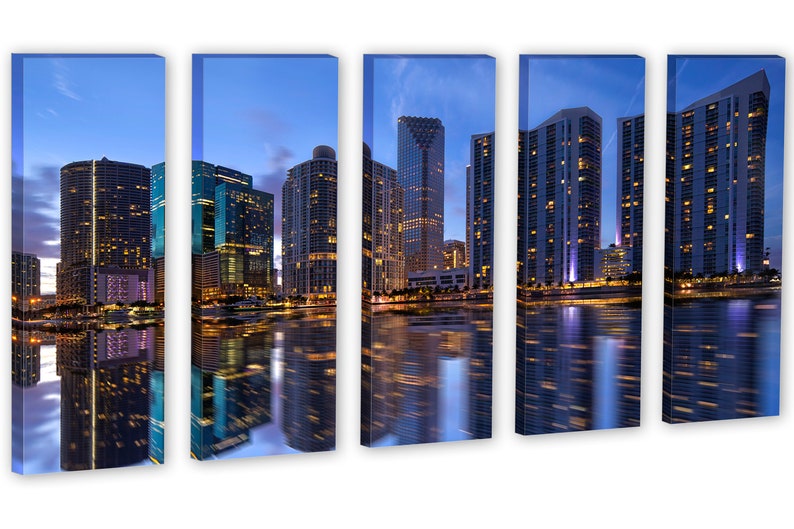
Image resolution: width=794 pixels, height=529 pixels. In order to click on painting in this screenshot , I will do `click(461, 114)`.